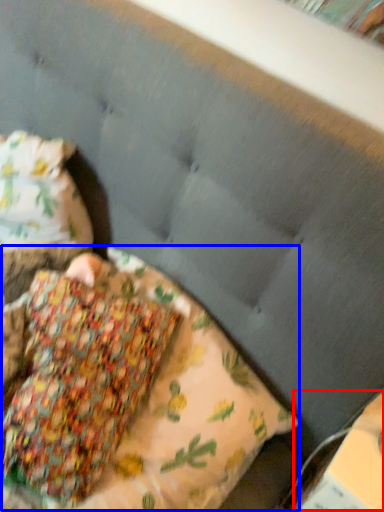
Question: Among these objects, which one is farthest to the camera, paperback book (highlighted by a red box) or pillow (highlighted by a blue box)?

Choices:
 (A) paperback book
 (B) pillow

Answer: (A)